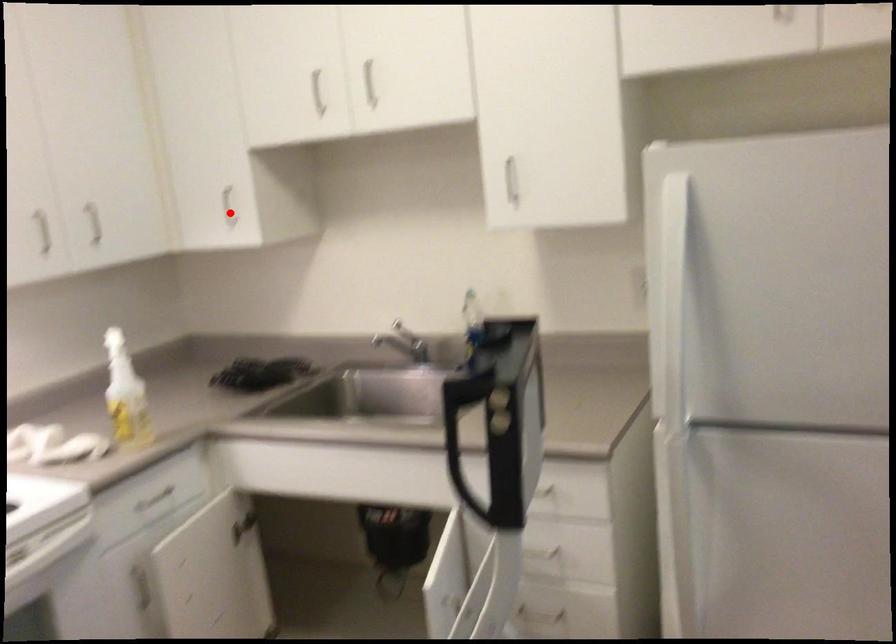
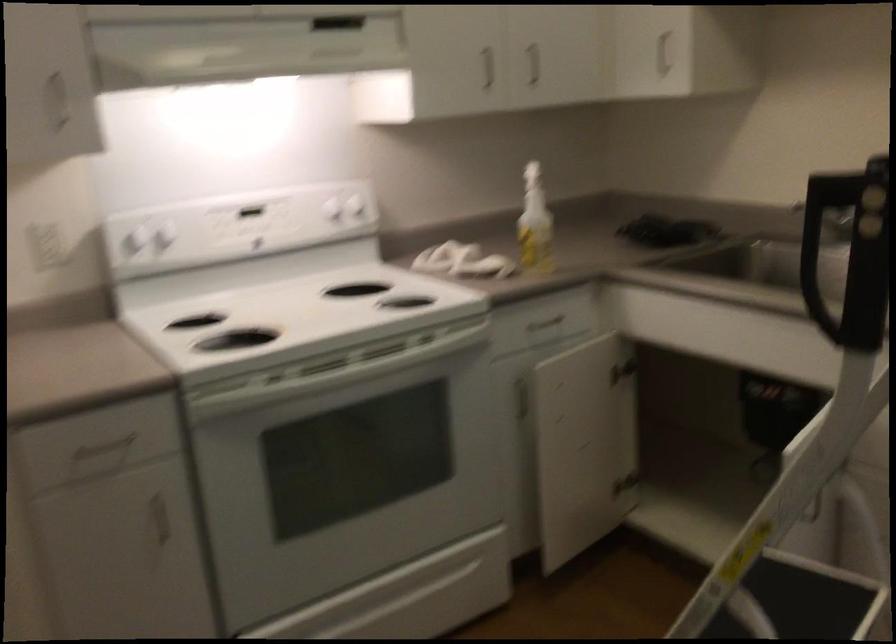
The point at the highlighted location is marked in the first image. Where is the corresponding point in the second image?

(661, 53)